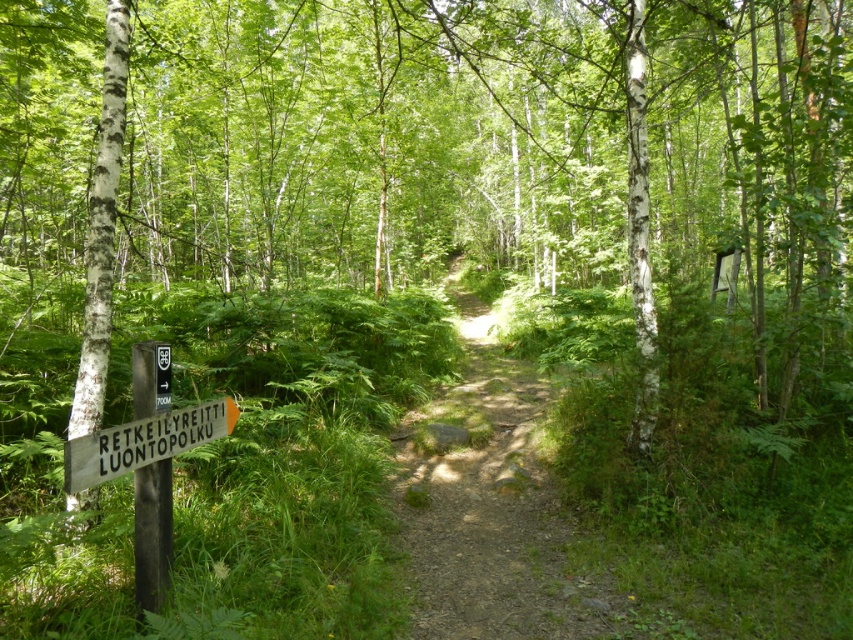
You are a hiker trying to follow the dirt path at center. There is a wooden sign at lower left nearby. Which object is taller in the image?

The dirt path at center is much taller than the wooden sign at lower left.

You are a hiker trying to follow the dirt path at center and the white smooth birch at left. Which direction should you head to stay on the correct trail according to the signpost?

The dirt path at center is positioned on the right side of white smooth birch at left. To stay on the correct trail, you should head towards the dirt path at center which is to the right of the white smooth birch at left.

You are a hiker standing at the point marked by the coordinates (490, 504). According to the scene description, what is directly beneath your feet?

Result: The point marked by the coordinates (490, 504) indicates the dirt path at center, so the dirt path is directly beneath your feet.